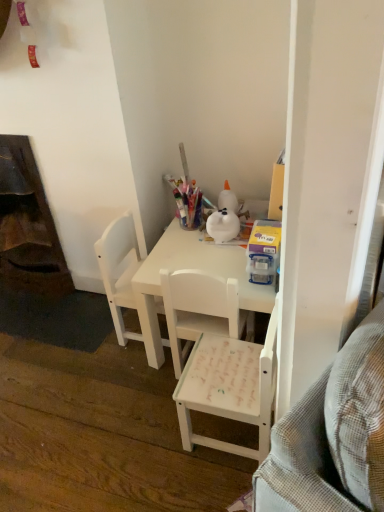
Identify the location of free space in front of white matte chair at center, which is counted as the third chair, starting from the right. The image size is (384, 512). (127, 377).